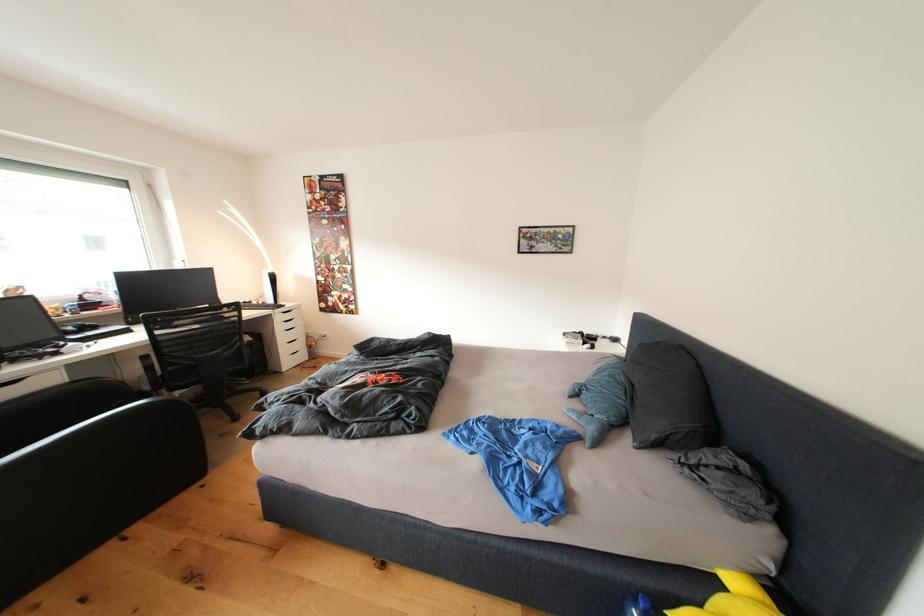
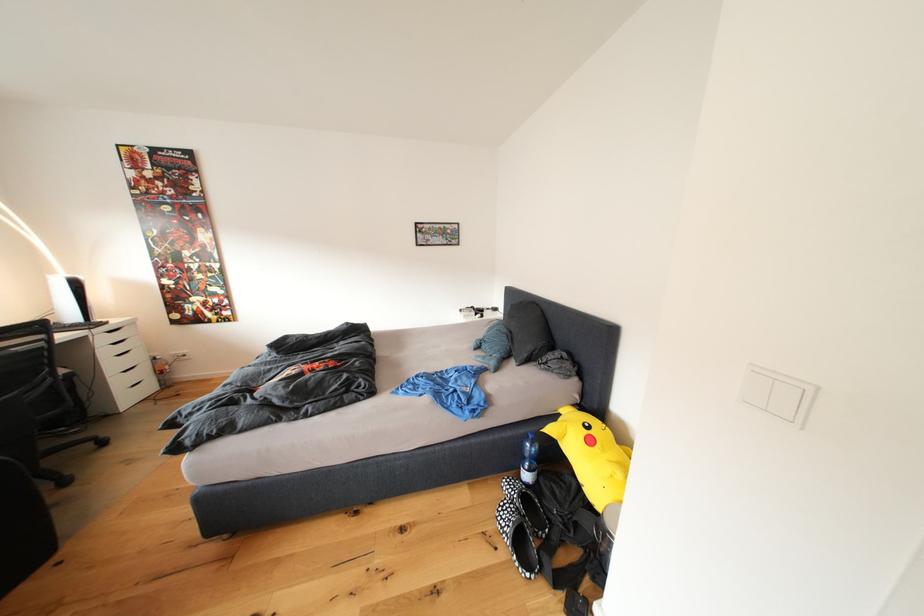
Which direction would the cameraman need to move to produce the second image?

The movement direction of the cameraman is left, backward.